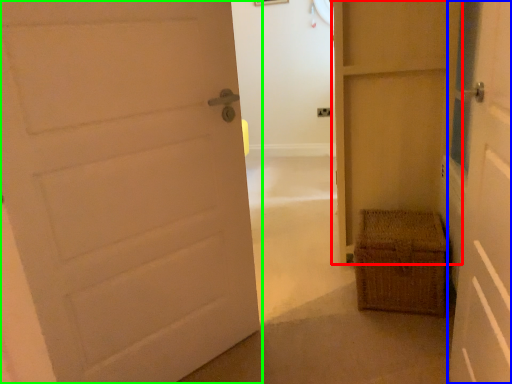
Question: Considering the real-world distances, which object is farthest from door (highlighted by a red box)? door (highlighted by a blue box) or door (highlighted by a green box)?

Choices:
 (A) door
 (B) door

Answer: (B)